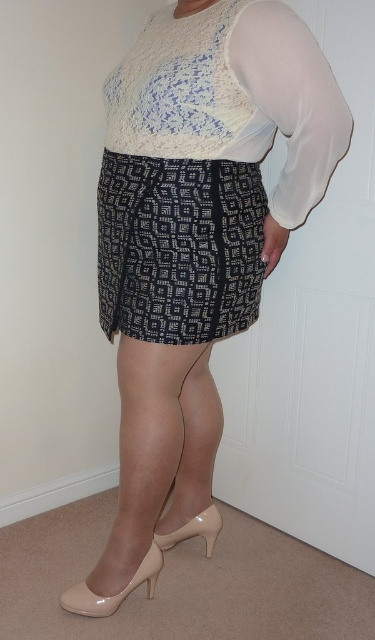
Question: Which point is closer to the camera?

Choices:
 (A) (67, 604)
 (B) (184, 525)
 (C) (138, 408)
 (D) (232, 285)

Answer: (D)

Question: Can you confirm if black printed fabric skirt at center is positioned below matte beige high-heeled shoe at lower center?

Choices:
 (A) no
 (B) yes

Answer: (A)

Question: Among these objects, which one is farthest from the camera?

Choices:
 (A) matte beige pump at lower center
 (B) matte beige high-heeled shoe at lower center

Answer: (A)

Question: Can you confirm if black printed fabric skirt at center is bigger than nude patent leather high heels at lower center?

Choices:
 (A) no
 (B) yes

Answer: (A)

Question: Which of the following is the closest to the observer?

Choices:
 (A) (211, 529)
 (B) (259, 266)
 (C) (118, 556)

Answer: (B)

Question: Can you confirm if nude patent leather high heels at lower center is positioned to the right of matte beige high-heeled shoe at lower center?

Choices:
 (A) yes
 (B) no

Answer: (A)